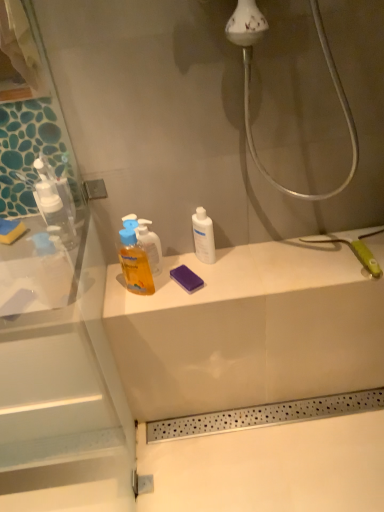
Identify the location of free location in front of white matte bottle at center. (211, 284).